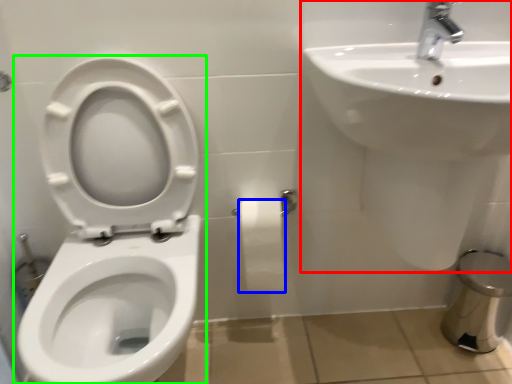
Question: Considering the real-world distances, which object is farthest from sink (highlighted by a red box)? toilet paper (highlighted by a blue box) or toilet (highlighted by a green box)?

Choices:
 (A) toilet paper
 (B) toilet

Answer: (B)